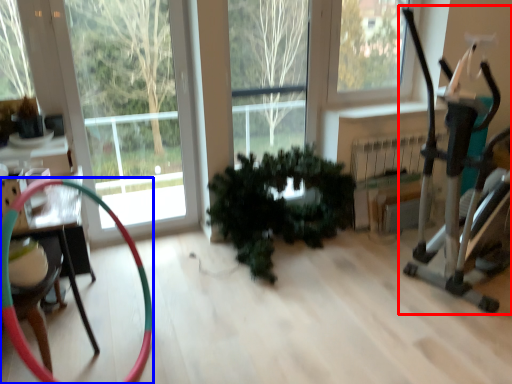
Question: Which object appears closest to the camera in this image, baby carriage (highlighted by a red box) or garden hose (highlighted by a blue box)?

Choices:
 (A) baby carriage
 (B) garden hose

Answer: (B)